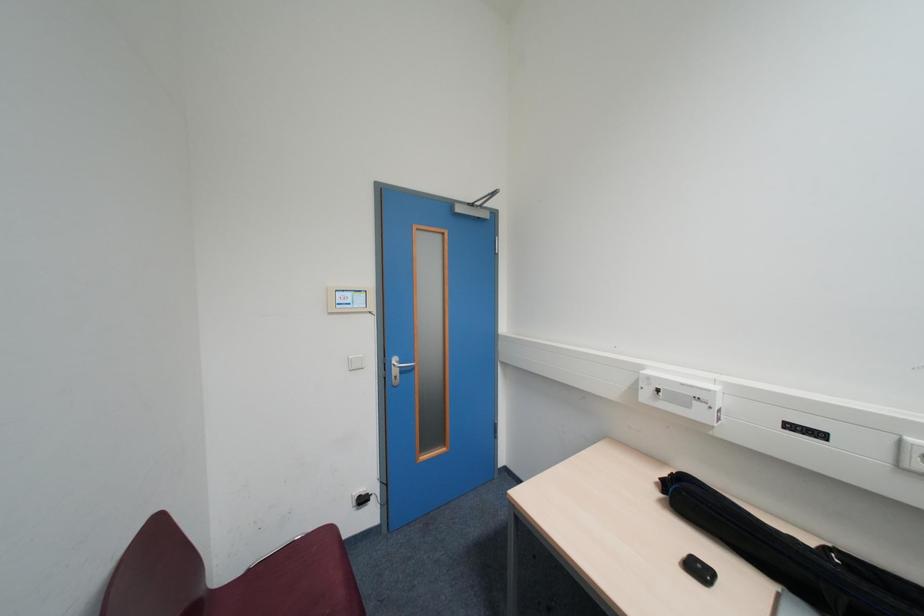
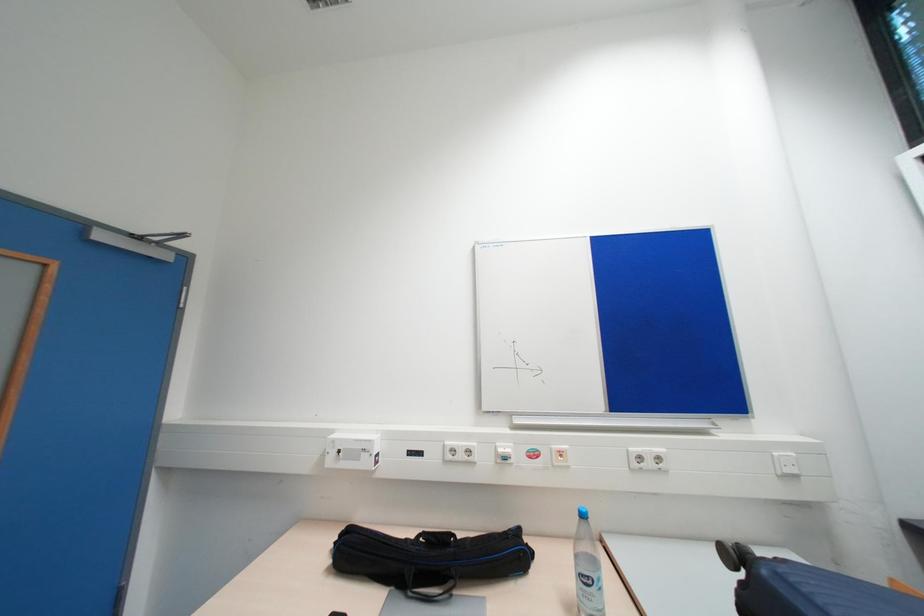
Question: How did the camera likely rotate?

Choices:
 (A) Left
 (B) Right
 (C) Up
 (D) Down

Answer: (B)